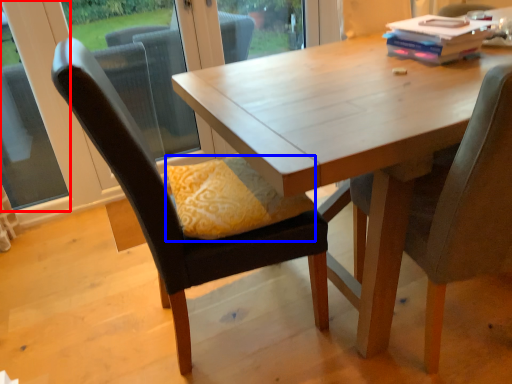
Question: Which of the following is the closest to the observer, window (highlighted by a red box) or pillow (highlighted by a blue box)?

Choices:
 (A) window
 (B) pillow

Answer: (B)